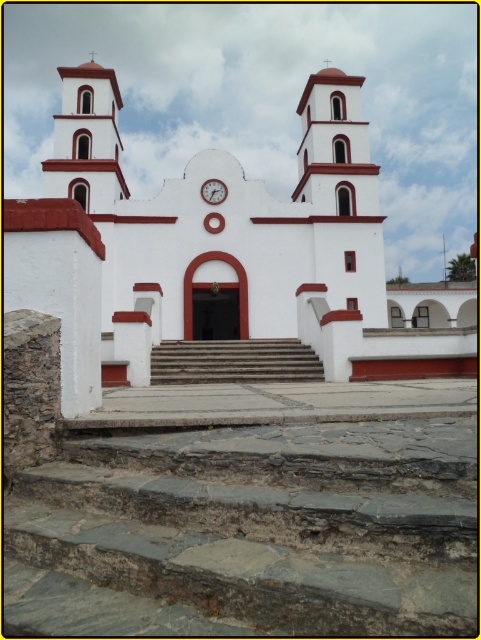
You are standing in front of the church and want to know which object is shorter between the smooth stone stairs at center and the white matte clock at center. Could you tell me which one is shorter?

The smooth stone stairs at center is not as tall as the white matte clock at center, so the smooth stone stairs at center is shorter.

Based on the photo, you are a visitor approaching the church entrance and need to know which object is bigger between the smooth stone stairs at center and the white matte clock at center. Can you tell me?

The smooth stone stairs at center is larger in size than the white matte clock at center.

You are standing in front of the church and want to enter through the central doorway. Which object, the gray stone stairs at center or the white stucco spire at upper left, is closer to the entrance?

The gray stone stairs at center are closer to the entrance because they are to the right of the white stucco spire at upper left, which is positioned further away.